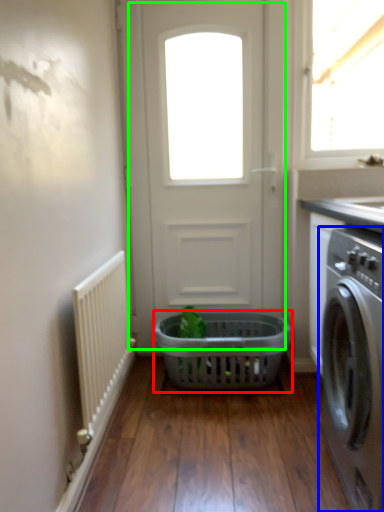
Question: Which object is positioned closest to basket (highlighted by a red box)? Select from washing machine (highlighted by a blue box) and door (highlighted by a green box).

Choices:
 (A) washing machine
 (B) door

Answer: (B)